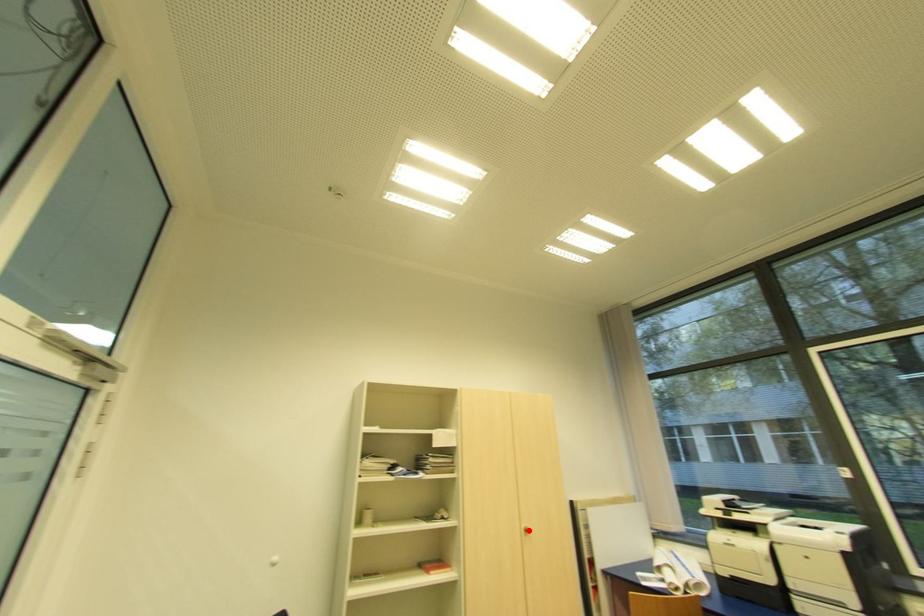
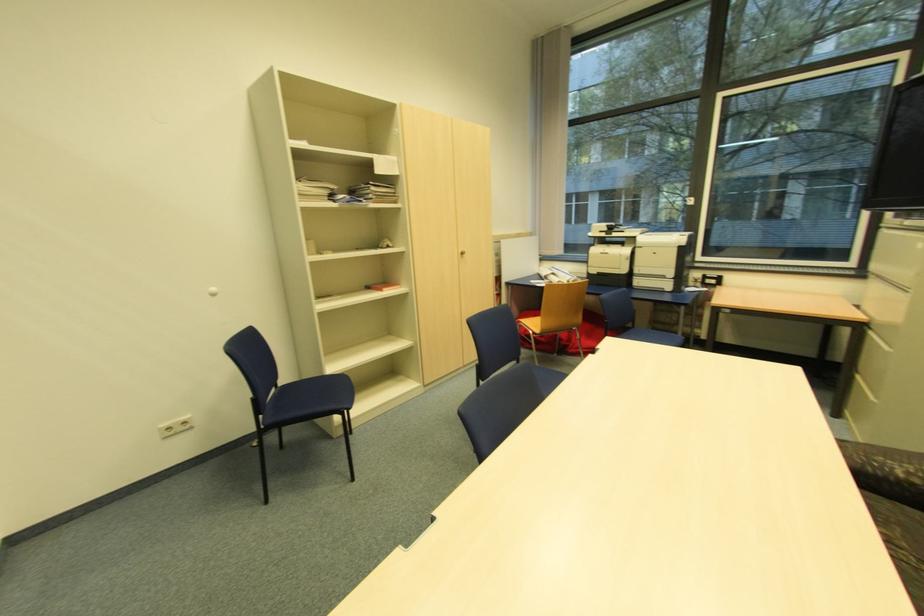
In the second image, find the point that corresponds to the highlighted location in the first image.

(466, 254)